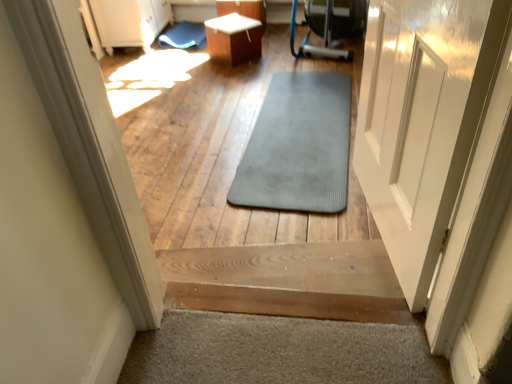
Question: Which direction should I rotate to face gray rubber mat at center, which is the 2th mat in top-to-bottom order, — up or down?

Choices:
 (A) down
 (B) up

Answer: (B)

Question: From a real-world perspective, is white glossy table at center located higher than gray rubber mat at center, positioned as the first mat in bottom-to-top order?

Choices:
 (A) no
 (B) yes

Answer: (B)

Question: Is white glossy table at center further to the viewer compared to gray rubber mat at center, which is the first mat from front to back?

Choices:
 (A) no
 (B) yes

Answer: (B)

Question: Is white glossy table at center at the right side of gray rubber mat at center, which is the 2th mat in top-to-bottom order?

Choices:
 (A) no
 (B) yes

Answer: (A)

Question: Is white glossy table at center positioned before gray rubber mat at center, which ranks as the 2th mat in left-to-right order?

Choices:
 (A) no
 (B) yes

Answer: (A)

Question: Can you confirm if white glossy table at center is wider than gray rubber mat at center, which appears as the second mat when viewed from the back?

Choices:
 (A) no
 (B) yes

Answer: (A)

Question: From the image's perspective, is white glossy table at center under gray rubber mat at center, which ranks as the 1th mat in right-to-left order?

Choices:
 (A) no
 (B) yes

Answer: (A)

Question: Considering the relative sizes of gray rubber mat at center and white glossy table at center in the image provided, is gray rubber mat at center thinner than white glossy table at center?

Choices:
 (A) yes
 (B) no

Answer: (A)

Question: Can you confirm if gray rubber mat at center is positioned to the left of white glossy table at center?

Choices:
 (A) no
 (B) yes

Answer: (A)

Question: Does gray rubber mat at center have a greater width compared to white glossy table at center?

Choices:
 (A) yes
 (B) no

Answer: (B)

Question: Is gray rubber mat at center turned away from white glossy table at center?

Choices:
 (A) yes
 (B) no

Answer: (B)

Question: From the image's perspective, is gray rubber mat at center on top of white glossy table at center?

Choices:
 (A) yes
 (B) no

Answer: (B)

Question: Is gray rubber mat at center not inside white glossy table at center?

Choices:
 (A) no
 (B) yes

Answer: (B)

Question: Is wooden stairs at center smaller than blue rubber mat at upper center, which is counted as the second mat, starting from the right?

Choices:
 (A) no
 (B) yes

Answer: (A)